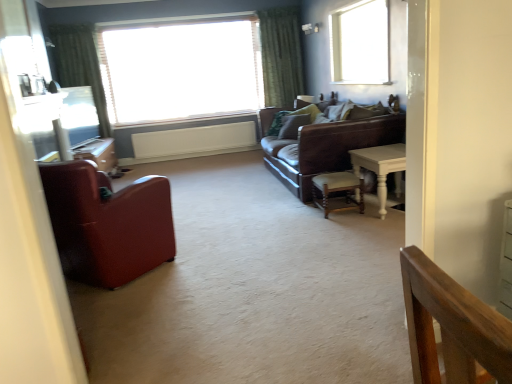
Locate an element on the screen. The image size is (512, 384). green textured curtain at upper center, positioned as the 1th curtain in right-to-left order is located at coordinates (281, 55).

Find the location of a particular element. white plastic radiator at center is located at coordinates (193, 141).

The image size is (512, 384). Describe the element at coordinates (268, 128) in the screenshot. I see `brown leather couch at center` at that location.

Where is `matte glass window screen at left`? The width and height of the screenshot is (512, 384). matte glass window screen at left is located at coordinates (79, 115).

Considering the positions of objects green fabric curtain at upper left, which appears as the first curtain when viewed from the left, and white plastic radiator at center in the image provided, who is more to the right, green fabric curtain at upper left, which appears as the first curtain when viewed from the left, or white plastic radiator at center?

Positioned to the right is white plastic radiator at center.

Considering the sizes of objects green fabric curtain at upper left, which is the second curtain in right-to-left order, and white plastic radiator at center in the image provided, who is taller, green fabric curtain at upper left, which is the second curtain in right-to-left order, or white plastic radiator at center?

Standing taller between the two is green fabric curtain at upper left, which is the second curtain in right-to-left order.

Where is `radiator that is behind the green fabric curtain at upper left, which is the second curtain in right-to-left order`? The image size is (512, 384). radiator that is behind the green fabric curtain at upper left, which is the second curtain in right-to-left order is located at coordinates (193, 141).

What are the coordinates of `radiator behind the leather armchair at left, the second chair positioned from the back` in the screenshot? It's located at (193, 141).

From their relative heights in the image, would you say white plastic radiator at center is taller or shorter than leather armchair at left, the first chair from the front?

Considering their sizes, white plastic radiator at center has less height than leather armchair at left, the first chair from the front.

How different are the orientations of white plastic radiator at center and leather armchair at left, the first chair from the front, in degrees?

white plastic radiator at center and leather armchair at left, the first chair from the front, are facing 138 degrees away from each other.

From the image's perspective, is white plastic radiator at center located above leather armchair at left, the first chair from the front?

Yes, from the image's perspective, white plastic radiator at center is above leather armchair at left, the first chair from the front.

Where is `chair that is above the wooden chair at center, which is the second chair from left to right (from a real-world perspective)`? The width and height of the screenshot is (512, 384). chair that is above the wooden chair at center, which is the second chair from left to right (from a real-world perspective) is located at coordinates (106, 223).

From a real-world perspective, is leather armchair at left, the first chair from the front, beneath wooden chair at center, positioned as the first chair in right-to-left order?

No, from a real-world perspective, leather armchair at left, the first chair from the front, is not beneath wooden chair at center, positioned as the first chair in right-to-left order.

Consider the image. Could you measure the distance between leather armchair at left, the second chair positioned from the back, and wooden chair at center, which ranks as the first chair in back-to-front order?

1.66 meters.

Does point (119, 204) come closer to viewer compared to point (322, 188)?

Yes, it is.

Is wooden chair at center, which ranks as the first chair in back-to-front order, outside of green textured curtain at upper center, the second curtain in the left-to-right sequence?

wooden chair at center, which ranks as the first chair in back-to-front order, lies outside green textured curtain at upper center, the second curtain in the left-to-right sequence,'s area.

Which object is positioned more to the left, wooden chair at center, the 2th chair from the front, or green textured curtain at upper center, the second curtain in the left-to-right sequence?

green textured curtain at upper center, the second curtain in the left-to-right sequence.

From the image's perspective, relative to green textured curtain at upper center, the second curtain in the left-to-right sequence, is wooden chair at center, which is the second chair from left to right, above or below?

Based on their image positions, wooden chair at center, which is the second chair from left to right, is located beneath green textured curtain at upper center, the second curtain in the left-to-right sequence.

Is there a large distance between wooden chair at center, which is the second chair from left to right, and green textured curtain at upper center, the second curtain in the left-to-right sequence?

Yes, wooden chair at center, which is the second chair from left to right, and green textured curtain at upper center, the second curtain in the left-to-right sequence, are quite far apart.

Looking at this image, does green textured curtain at upper center, positioned as the 1th curtain in right-to-left order, have a lesser height compared to transparent glass window at upper right, the 1th window viewed from the front?

In fact, green textured curtain at upper center, positioned as the 1th curtain in right-to-left order, may be taller than transparent glass window at upper right, the 1th window viewed from the front.

Based on their sizes in the image, would you say green textured curtain at upper center, the second curtain in the left-to-right sequence, is bigger or smaller than transparent glass window at upper right, the 1th window viewed from the right?

In the image, green textured curtain at upper center, the second curtain in the left-to-right sequence, appears to be larger than transparent glass window at upper right, the 1th window viewed from the right.

Considering the sizes of green textured curtain at upper center, the second curtain in the left-to-right sequence, and transparent glass window at upper right, positioned as the second window in left-to-right order, in the image, is green textured curtain at upper center, the second curtain in the left-to-right sequence, wider or thinner than transparent glass window at upper right, positioned as the second window in left-to-right order,?

Clearly, green textured curtain at upper center, the second curtain in the left-to-right sequence, has more width compared to transparent glass window at upper right, positioned as the second window in left-to-right order.

Locate an element on the screen. The image size is (512, 384). curtain above the transparent glass window at upper right, the 1th window viewed from the right (from the image's perspective) is located at coordinates (281, 55).

Which point is more distant from viewer, (325, 191) or (231, 124)?

The point (231, 124) is farther.

Between wooden chair at center, positioned as the first chair in right-to-left order, and white plastic radiator at center, which one has more height?

Standing taller between the two is white plastic radiator at center.

Is wooden chair at center, positioned as the first chair in right-to-left order, in contact with white plastic radiator at center?

They are not placed beside each other.

Consider the image. Considering the sizes of objects wooden chair at center, positioned as the first chair in right-to-left order, and white plastic radiator at center in the image provided, who is smaller, wooden chair at center, positioned as the first chair in right-to-left order, or white plastic radiator at center?

Smaller between the two is wooden chair at center, positioned as the first chair in right-to-left order.

Does brown leather couch at center turn towards green fabric curtain at upper left, which is the second curtain in right-to-left order?

Yes, brown leather couch at center is oriented towards green fabric curtain at upper left, which is the second curtain in right-to-left order.

From the image's perspective, which is below, brown leather couch at center or green fabric curtain at upper left, which is the second curtain in right-to-left order?

From the image's view, brown leather couch at center is below.

Is brown leather couch at center in front of or behind green fabric curtain at upper left, which appears as the first curtain when viewed from the left, in the image?

In the image, brown leather couch at center appears in front of green fabric curtain at upper left, which appears as the first curtain when viewed from the left.

There is a brown leather couch at center. Where is `the 1st curtain above it (from the image's perspective)`? The height and width of the screenshot is (384, 512). the 1st curtain above it (from the image's perspective) is located at coordinates (80, 65).

Identify the location of radiator behind the green fabric curtain at upper left, which is the second curtain in right-to-left order. (193, 141).

The height and width of the screenshot is (384, 512). I want to click on radiator that appears above the leather armchair at left, placed as the first chair when sorted from left to right (from the image's perspective), so click(193, 141).

Estimate the real-world distances between objects in this image. Which object is further from wooden chair at center, which is the second chair from left to right, brown leather couch at center or matte glass window screen at left?

Based on the image, matte glass window screen at left appears to be further to wooden chair at center, which is the second chair from left to right.

From the image, which object appears to be farther from brown leather couch at center, green fabric curtain at upper left, which appears as the first curtain when viewed from the left, or leather armchair at left, placed as the first chair when sorted from left to right?

Based on the image, green fabric curtain at upper left, which appears as the first curtain when viewed from the left, appears to be further to brown leather couch at center.

Looking at the image, which one is located closer to white plastic radiator at center, white wooden table at right or green textured curtain at upper center, the second curtain in the left-to-right sequence?

The object closer to white plastic radiator at center is green textured curtain at upper center, the second curtain in the left-to-right sequence.

Consider the image. Estimate the real-world distances between objects in this image. Which object is closer to transparent glass window at upper right, the 2th window viewed from the back, white wooden table at right or white plastic radiator at center?

white wooden table at right is closer to transparent glass window at upper right, the 2th window viewed from the back.

Looking at the image, which one is located further to green textured curtain at upper center, the second curtain in the left-to-right sequence, green fabric curtain at upper left, which is the second curtain in right-to-left order, or matte glass window screen at left?

Among the two, matte glass window screen at left is located further to green textured curtain at upper center, the second curtain in the left-to-right sequence.

From the image, which object appears to be nearer to leather armchair at left, placed as the first chair when sorted from left to right, green fabric curtain at upper left, which appears as the first curtain when viewed from the left, or wooden chair at center, positioned as the first chair in right-to-left order?

wooden chair at center, positioned as the first chair in right-to-left order, is positioned closer to the anchor leather armchair at left, placed as the first chair when sorted from left to right.

Based on their spatial positions, is transparent glass window at upper right, the 2th window viewed from the back, or white wooden table at right closer to leather armchair at left, the second chair positioned from the back?

Among the two, white wooden table at right is located nearer to leather armchair at left, the second chair positioned from the back.

Looking at the image, which one is located closer to green textured curtain at upper center, positioned as the 1th curtain in right-to-left order, white plastic radiator at center or white blinds at upper center, the second window viewed from the right?

white blinds at upper center, the second window viewed from the right, lies closer to green textured curtain at upper center, positioned as the 1th curtain in right-to-left order, than the other object.

The height and width of the screenshot is (384, 512). I want to click on studio couch between green fabric curtain at upper left, which appears as the first curtain when viewed from the left, and white wooden table at right, in the horizontal direction, so click(268, 128).

You are a GUI agent. You are given a task and a screenshot of the screen. Output one action in this format:
    pyautogui.click(x=<x>, y=<y>)
    Task: Click on the window positioned between transparent glass window at upper right, the 1th window viewed from the right, and white plastic radiator at center from near to far
    
    Given the screenshot: What is the action you would take?
    pyautogui.click(x=181, y=71)

Identify the location of curtain between matte glass window screen at left and white blinds at upper center, the 2th window when ordered from front to back, in the front-back direction. The image size is (512, 384). (80, 65).

I want to click on curtain between green fabric curtain at upper left, which is the second curtain in right-to-left order, and brown leather couch at center, so click(x=281, y=55).